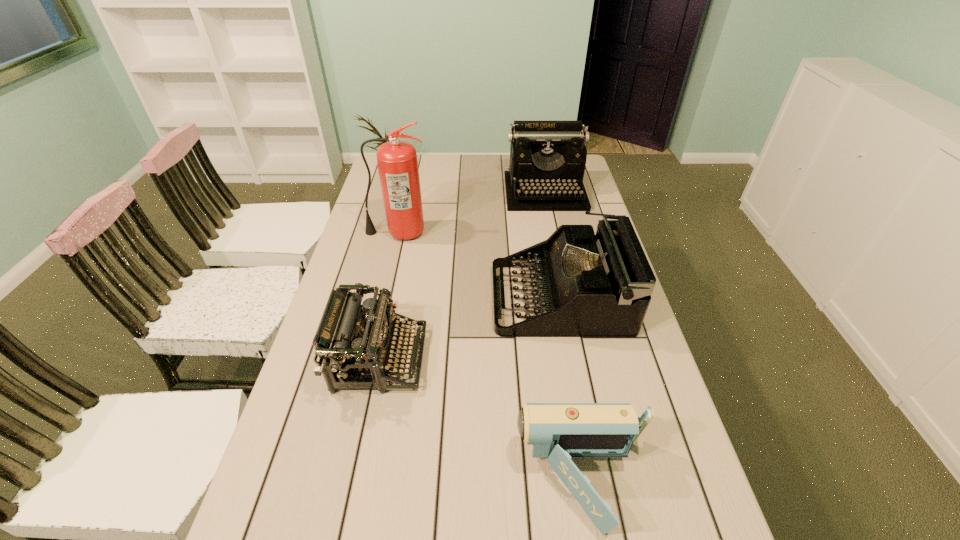
Where is `typewriter that stands as the closest to the tallest typewriter`? Image resolution: width=960 pixels, height=540 pixels. typewriter that stands as the closest to the tallest typewriter is located at coordinates (588, 285).